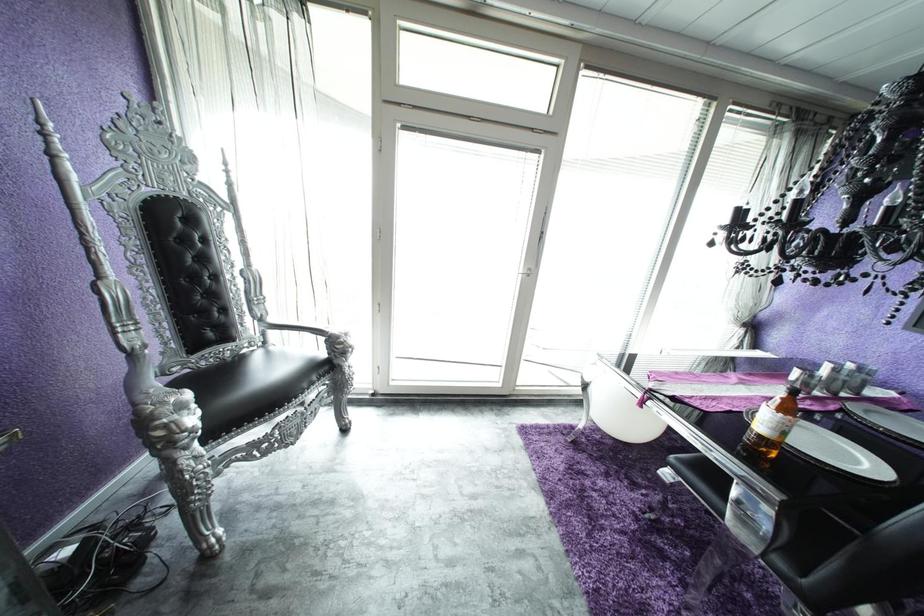
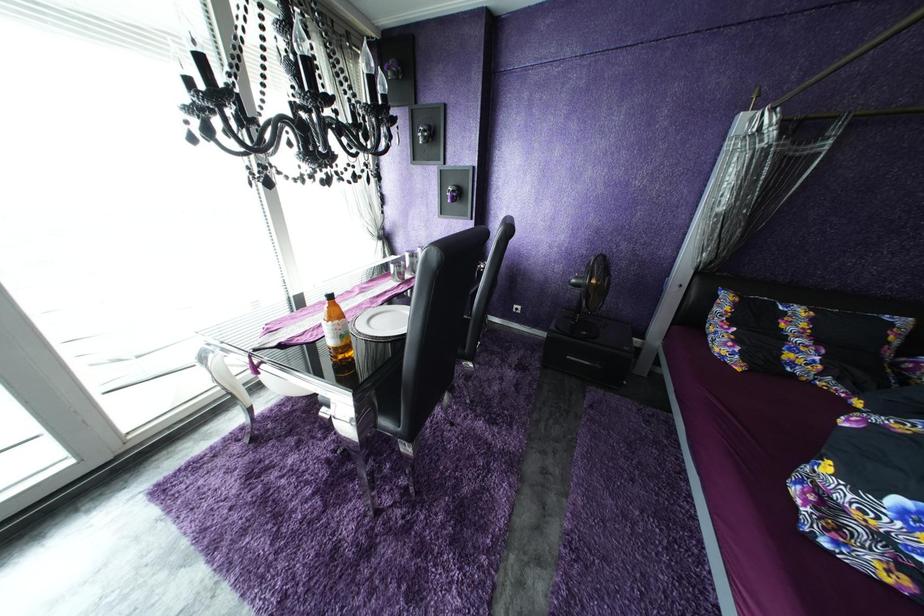
How did the camera likely rotate?

The rotation direction of the camera is right-down.